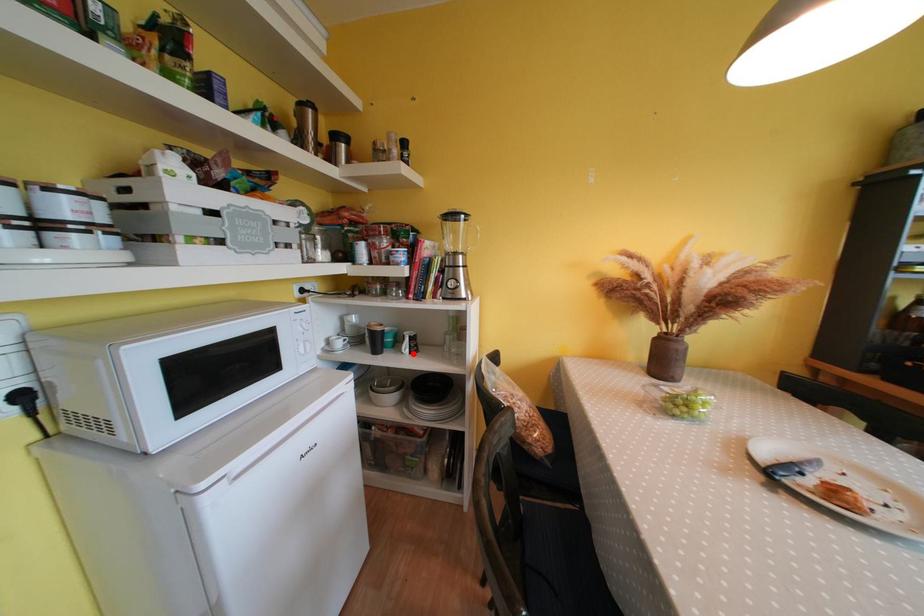
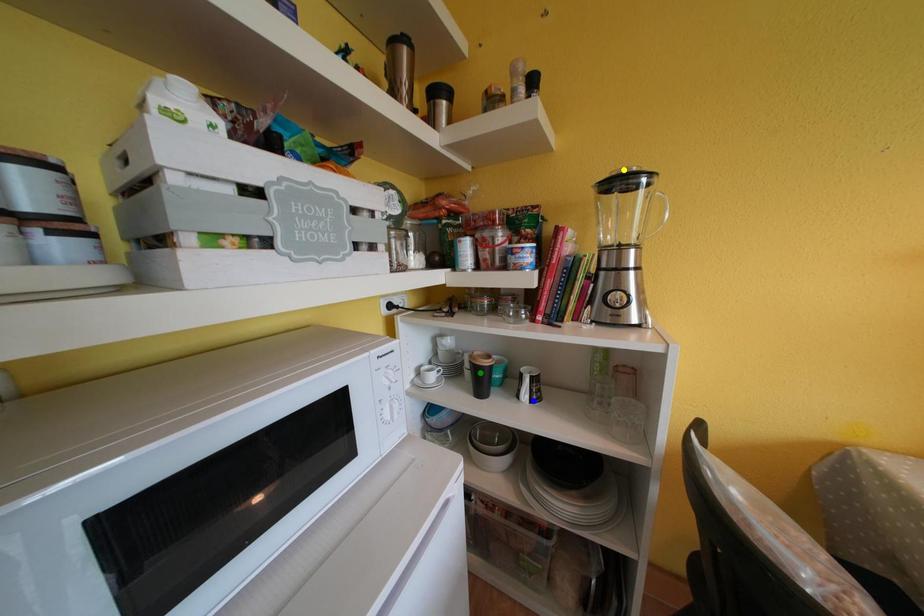
Question: I am providing you with two images of the same scene from different viewpoints. A red point is marked on the first image. You are given multiple points on the second image. Which point in image 2 is actually the same real-world point as the red point in image 1?

Choices:
 (A) yellow point
 (B) green point
 (C) blue point

Answer: (C)